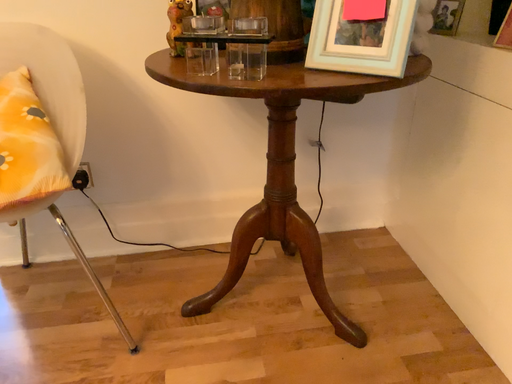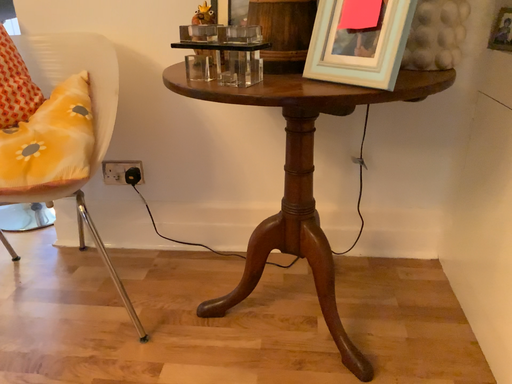
Question: How did the camera likely rotate when shooting the video?

Choices:
 (A) rotated left
 (B) rotated right

Answer: (A)